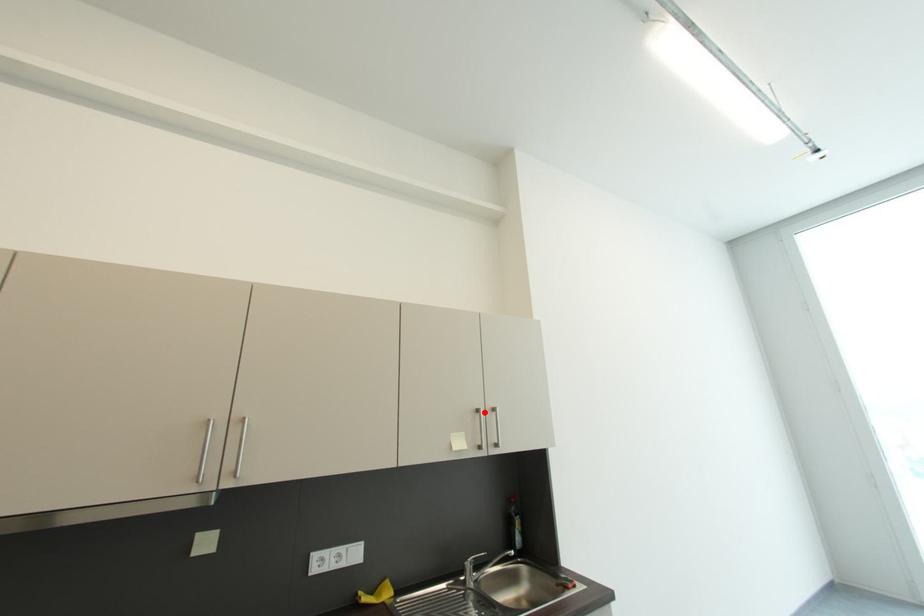
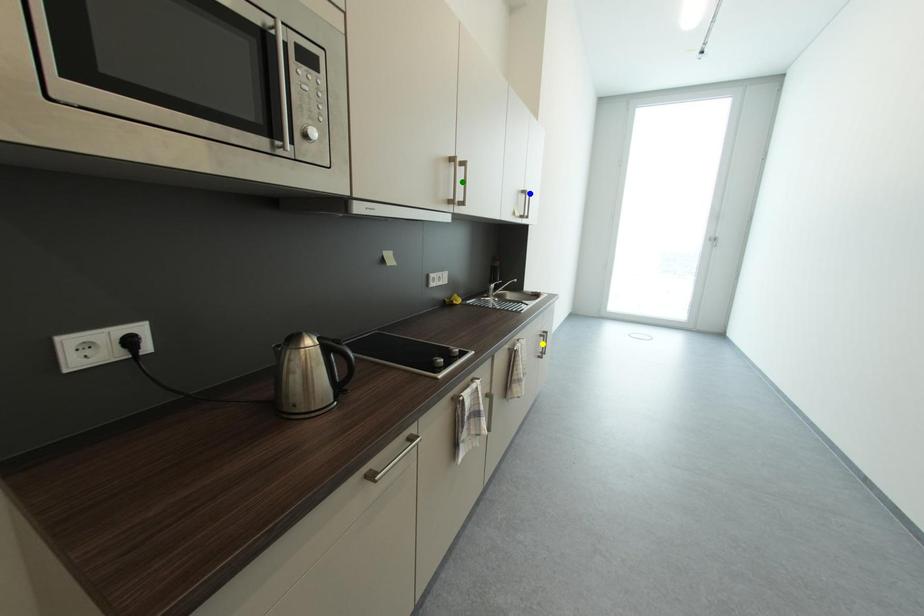
Question: I am providing you with two images of the same scene from different viewpoints. A red point is marked on the first image. You are given multiple points on the second image. Can you choose the point in image 2 that corresponds to the point in image 1?

Choices:
 (A) yellow point
 (B) green point
 (C) blue point

Answer: (C)